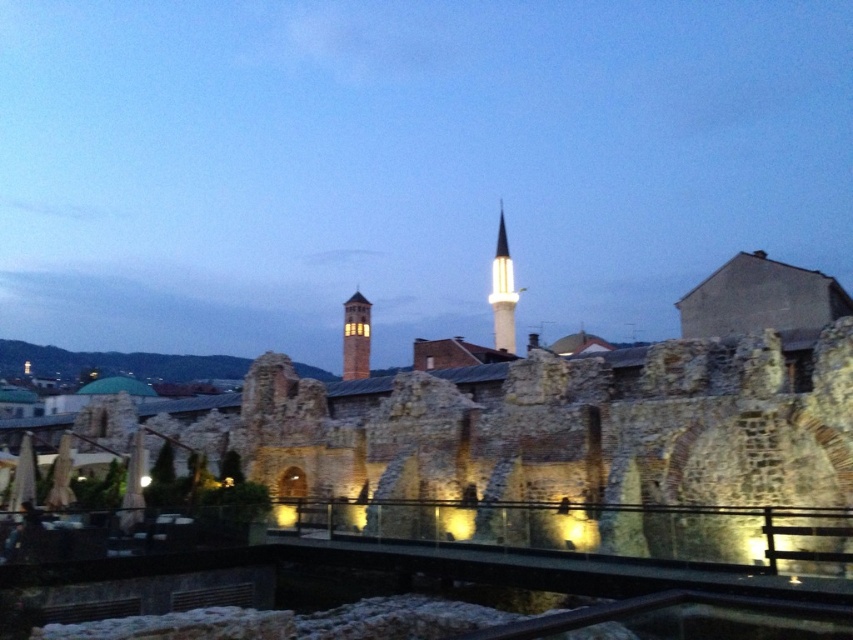
You are a tourist standing on the stone bridge with glass railing. You see the white marble minaret at center and the matte brick tower at center. Which one is bigger in size?

The white marble minaret at center is larger in size compared to the matte brick tower at center.

You are a tourist standing on the stone bridge with glass railing. You see the white marble minaret at center and the matte brick tower at center. Which one is taller?

The white marble minaret at center is much taller than the matte brick tower at center.